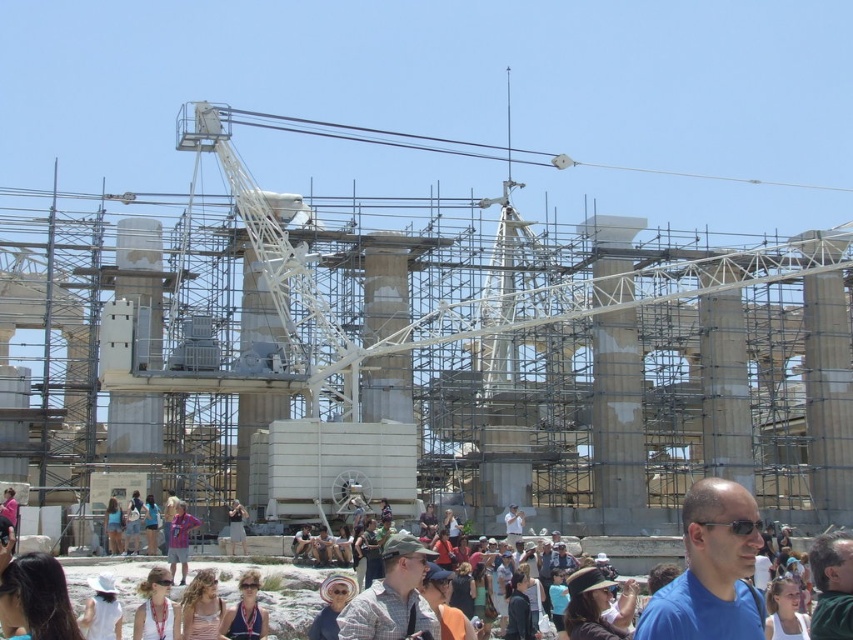
How much distance is there between matte purple dress at center and blue denim shorts at center?

matte purple dress at center and blue denim shorts at center are 52.39 feet apart from each other.

Who is taller, matte purple dress at center or blue denim shorts at center?

Standing taller between the two is blue denim shorts at center.

This screenshot has height=640, width=853. I want to click on matte purple dress at center, so click(x=245, y=611).

Can you confirm if matte purple dress at center is positioned to the left of denim jacket at center?

No, matte purple dress at center is not to the left of denim jacket at center.

Between point (233, 630) and point (233, 524), which one is positioned in front?

Point (233, 630)

Where is `matte purple dress at center`? The image size is (853, 640). matte purple dress at center is located at coordinates (245, 611).

Who is lower down, white fabric dress at center or blue denim shorts at center?

white fabric dress at center is lower down.

Does point (781, 582) lie behind point (109, 497)?

No, it is not.

The height and width of the screenshot is (640, 853). In order to click on white fabric dress at center in this screenshot , I will do `click(784, 611)`.